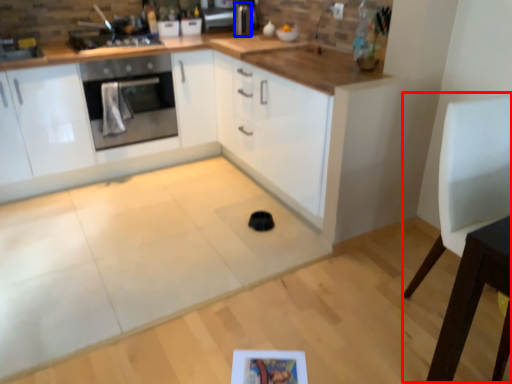
Question: Which object appears farthest to the camera in this image, chair (highlighted by a red box) or appliance (highlighted by a blue box)?

Choices:
 (A) chair
 (B) appliance

Answer: (B)